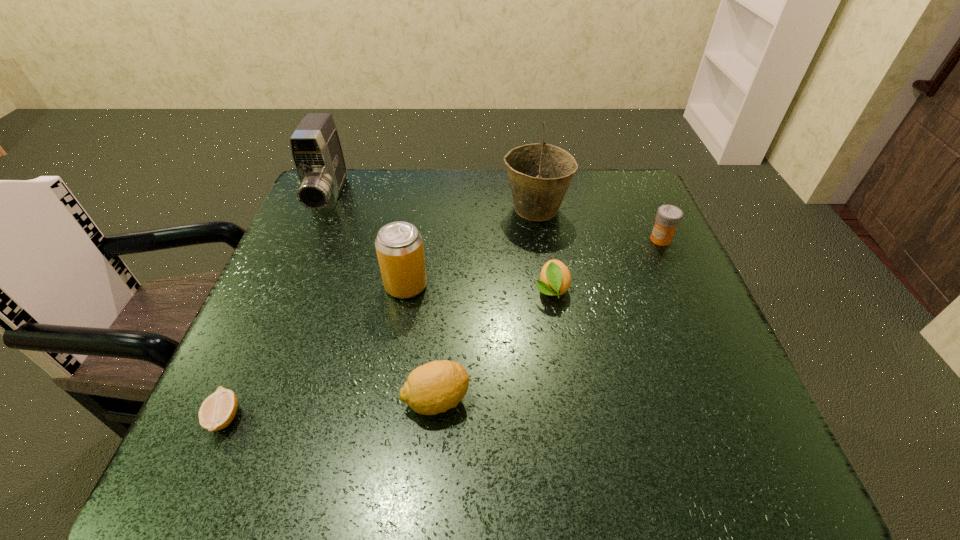
Where is `empty space between the second shortest lemon and the shortest lemon`? The image size is (960, 540). empty space between the second shortest lemon and the shortest lemon is located at coordinates (388, 354).

The width and height of the screenshot is (960, 540). I want to click on vacant area between the farthest lemon and the medicine, so pyautogui.click(x=606, y=265).

This screenshot has width=960, height=540. Identify the location of free space between the tallest object and the rightmost lemon. (543, 249).

Find the location of a particular element. This screenshot has width=960, height=540. vacant point located between the fifth shortest object and the second tallest lemon is located at coordinates (479, 288).

Locate an element on the screen. the fourth closest object to the leftmost lemon is located at coordinates (555, 279).

Point out which object is positioned as the fourth nearest to the second lemon from right to left. Please provide its 2D coordinates. Your answer should be formatted as a tuple, i.e. [(x, y)], where the tuple contains the x and y coordinates of a point satisfying the conditions above.

[(540, 174)]

Where is `the closest lemon relative to the second lemon from left to right`? the closest lemon relative to the second lemon from left to right is located at coordinates (555, 279).

Locate an element on the screen. This screenshot has width=960, height=540. lemon that is the closest to the sixth shortest object is located at coordinates (218, 410).

I want to click on free space that satisfies the following two spatial constraints: 1. on the back side of the leftmost lemon; 2. on the left side of the tallest object, so click(316, 209).

Find the location of a particular element. vacant space that satisfies the following two spatial constraints: 1. at the front of the pop (soda), highlighting the lens; 2. on the right side of the camcorder is located at coordinates (293, 286).